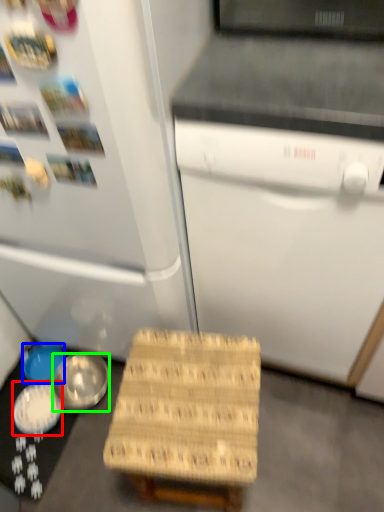
Question: Which object is positioned farthest from bowl (highlighted by a red box)? Select from bowl (highlighted by a blue box) and bowl (highlighted by a green box).

Choices:
 (A) bowl
 (B) bowl

Answer: (A)